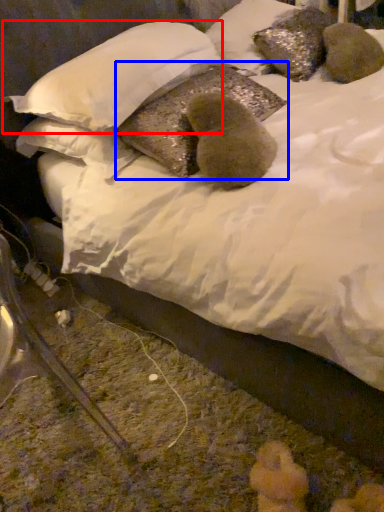
Question: Which of the following is the closest to the observer, pillow (highlighted by a red box) or pillow (highlighted by a blue box)?

Choices:
 (A) pillow
 (B) pillow

Answer: (A)